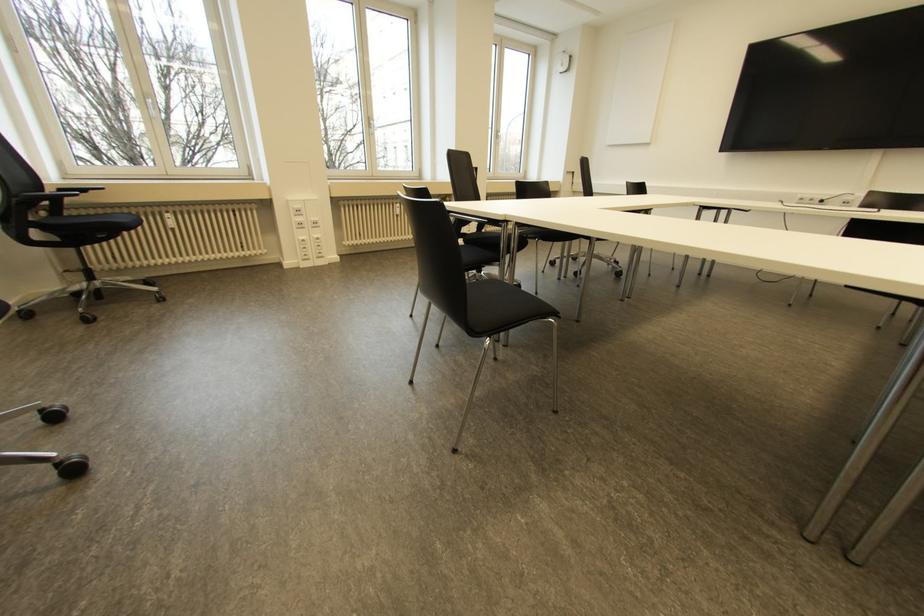
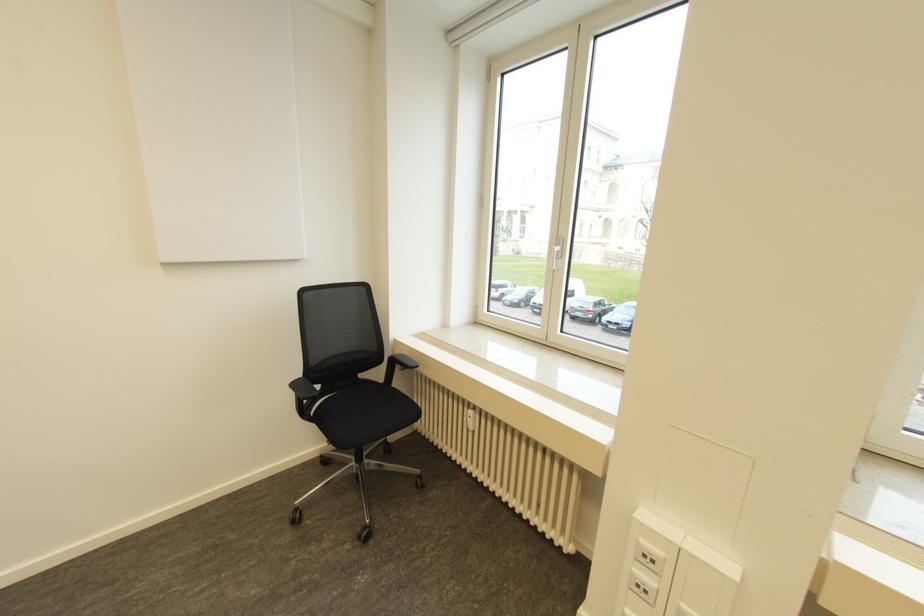
In the second image, find the point that corresponds to [166,215] in the first image.

(469, 411)